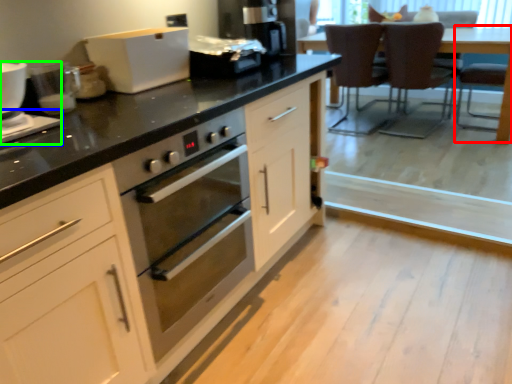
Question: Which is farther away from armchair (highlighted by a red box)? appliance (highlighted by a blue box) or appliance (highlighted by a green box)?

Choices:
 (A) appliance
 (B) appliance

Answer: (A)